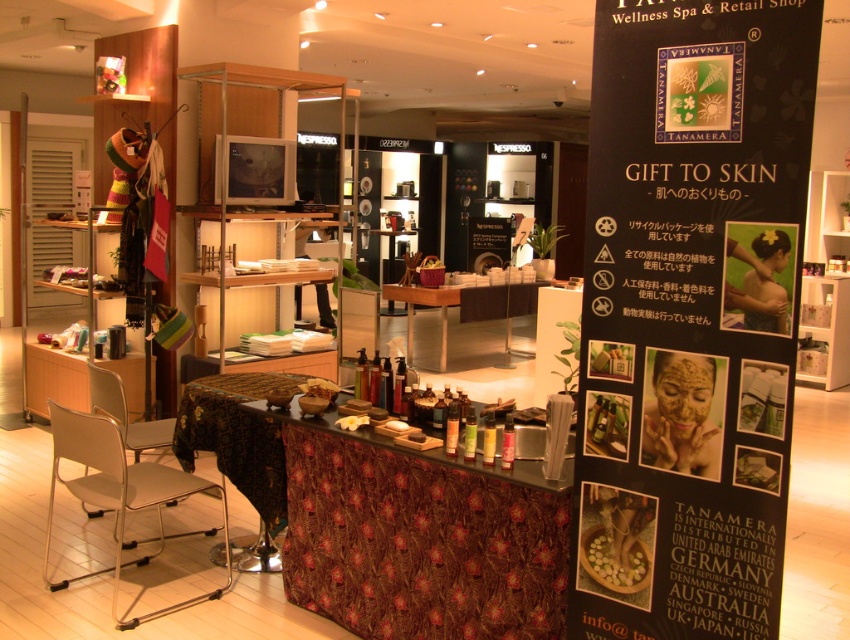
Question: Can you confirm if wooden table at center is positioned below metallic silver chair at lower left?

Choices:
 (A) yes
 (B) no

Answer: (B)

Question: Is patterned fabric table at center to the right of white plastic chair at lower left from the viewer's perspective?

Choices:
 (A) yes
 (B) no

Answer: (A)

Question: Can you confirm if patterned fabric table at center is positioned to the right of metallic silver chair at lower left?

Choices:
 (A) no
 (B) yes

Answer: (B)

Question: Among these objects, which one is farthest from the camera?

Choices:
 (A) black paper sign at right
 (B) patterned fabric table at center
 (C) metallic silver chair at lower left

Answer: (C)

Question: Estimate the real-world distances between objects in this image. Which object is closer to the metallic silver chair at lower left?

Choices:
 (A) black paper sign at right
 (B) wooden table at center
 (C) white plastic chair at lower left
 (D) patterned fabric table at center

Answer: (C)

Question: Which object appears closest to the camera in this image?

Choices:
 (A) black paper sign at right
 (B) metallic silver chair at lower left

Answer: (A)